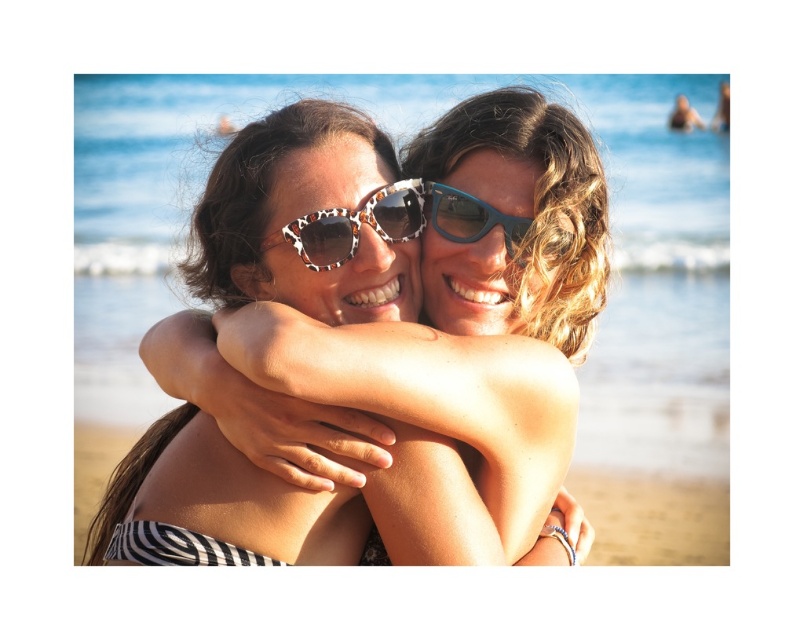
You are a photographer at the beach and want to ensure that both the matte black bikini top at center and the sandy tan skin at center are clearly visible in your photo. Given their current positions, which one might be more likely to appear in focus if you focus on the person in front?

The matte black bikini top at center is in front of the sandy tan skin at center, so focusing on the person in front would likely keep the matte black bikini top at center in focus while the sandy tan skin at center may appear slightly out of focus.

You are a photographer trying to capture the perfect shot of the sandy tan skin at center and the leopard print acetate sunglasses at center. Which object should you focus on first if you want to ensure both are in frame without moving the camera?

The sandy tan skin at center is bigger than the leopard print acetate sunglasses at center, so you should focus on the leopard print acetate sunglasses at center first to ensure both fit in the frame.